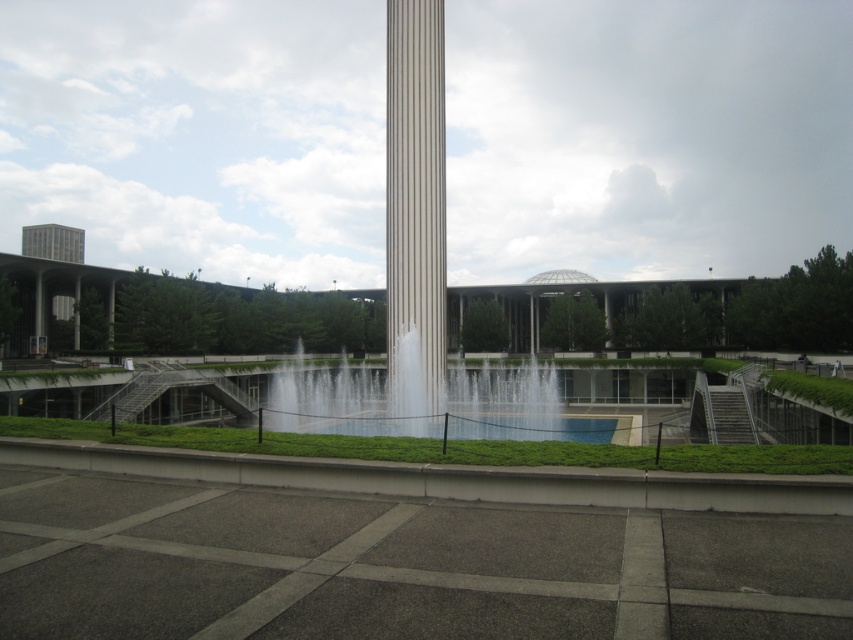
You are standing at the base of the gray concrete tower at upper left and want to reach the white glossy fountain at center. Which direction should you move to get there?

The white glossy fountain at center is located below the gray concrete tower at upper left, so you should move downward to reach it.

You are an architect designing a new plaza and want to place a new sculpture between the white glossy column at center and the gray concrete tower at upper left. Which object should the sculpture be closer to if it needs to take up more space than the smaller object but less than the larger one?

The sculpture should be closer to the gray concrete tower at upper left because the white glossy column at center occupies less space, so placing it near the larger gray concrete tower allows the sculpture to take up more space than the column but less than the tower.